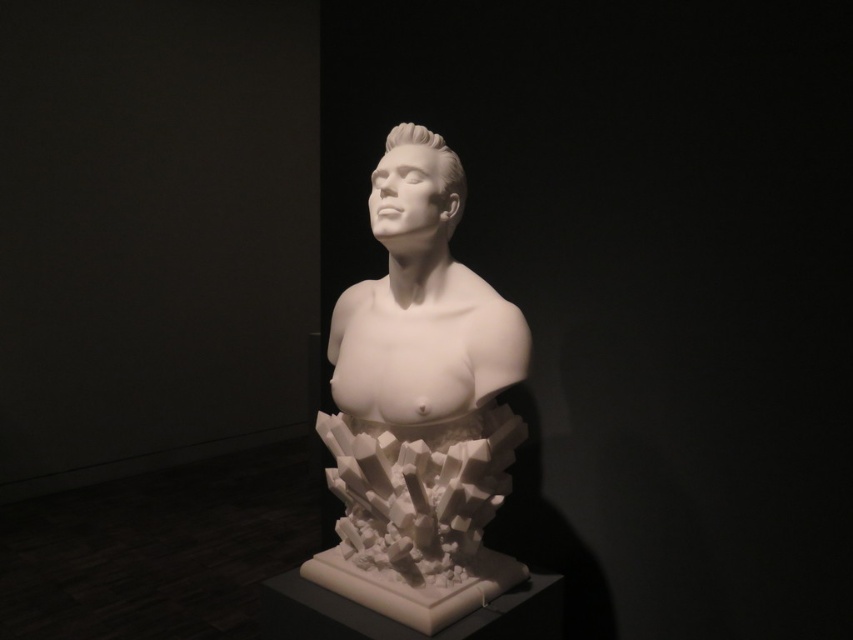
This screenshot has height=640, width=853. What are the coordinates of `white marble bust at center` in the screenshot? It's located at (419, 404).

Consider the image. Can you confirm if white marble bust at center is bigger than white glossy head at center?

Indeed, white marble bust at center has a larger size compared to white glossy head at center.

Does point (468, 472) come in front of point (424, 196)?

That is True.

What are the coordinates of `white marble bust at center` in the screenshot? It's located at (419, 404).